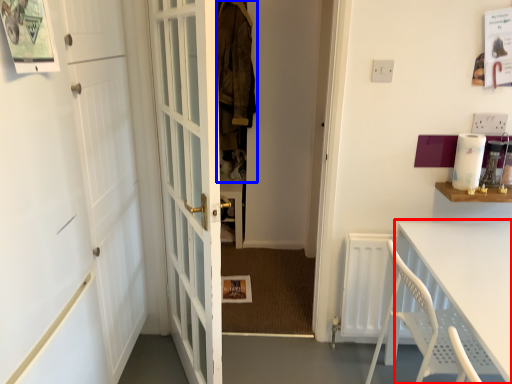
Question: Which of the following is the closest to the observer, table (highlighted by a red box) or laundry (highlighted by a blue box)?

Choices:
 (A) table
 (B) laundry

Answer: (A)